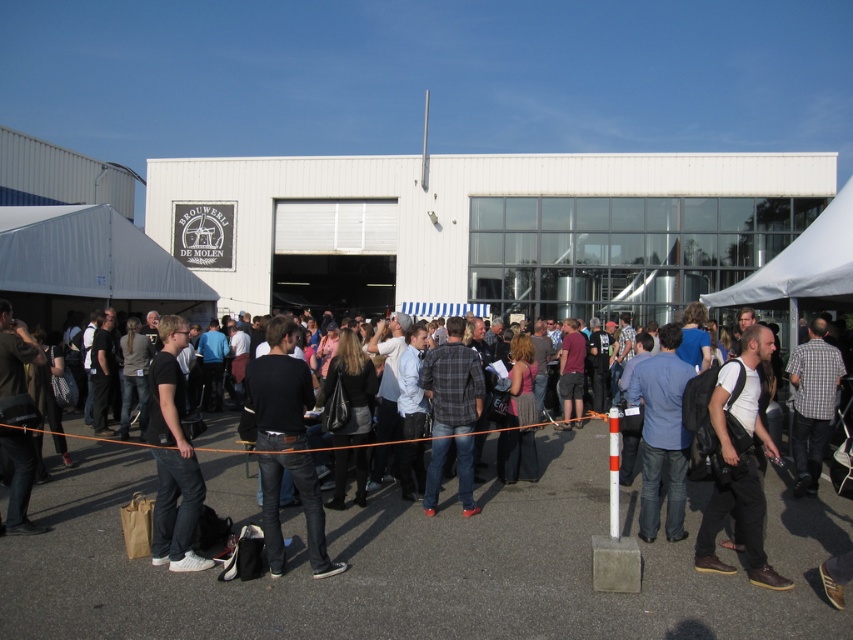
Question: Based on their relative distances, which object is farther from the dark gray jeans at lower left?

Choices:
 (A) blue denim jeans at center
 (B) white matte shirt at center-right
 (C) checkered shirt at center
 (D) black matte shirt at center

Answer: (C)

Question: Among these points, which one is nearest to the camera?

Choices:
 (A) (717, 499)
 (B) (163, 528)
 (C) (657, 470)

Answer: (B)

Question: Is blue denim jeans at center below checkered shirt at center?

Choices:
 (A) no
 (B) yes

Answer: (B)

Question: Considering the real-world distances, which object is farthest from the dark blue jeans at center?

Choices:
 (A) dark gray jeans at lower left
 (B) black matte shirt at center
 (C) white matte shirt at center-right

Answer: (A)

Question: Can you confirm if dark blue jeans at center is wider than blue denim jeans at center?

Choices:
 (A) no
 (B) yes

Answer: (B)

Question: Does black leather jacket at center appear under checkered shirt at center?

Choices:
 (A) no
 (B) yes

Answer: (B)